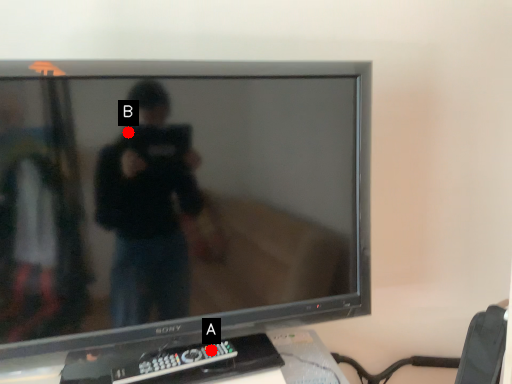
Question: Two points are circled on the image, labeled by A and B beside each circle. Which point is further to the camera?

Choices:
 (A) A is further
 (B) B is further

Answer: (A)